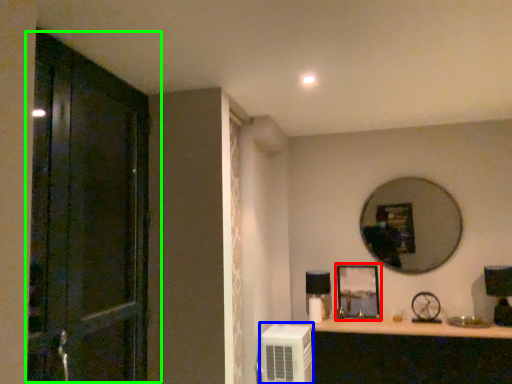
Question: Which is farther away from picture frame (highlighted by a red box)? air conditioner (highlighted by a blue box) or door (highlighted by a green box)?

Choices:
 (A) air conditioner
 (B) door

Answer: (B)